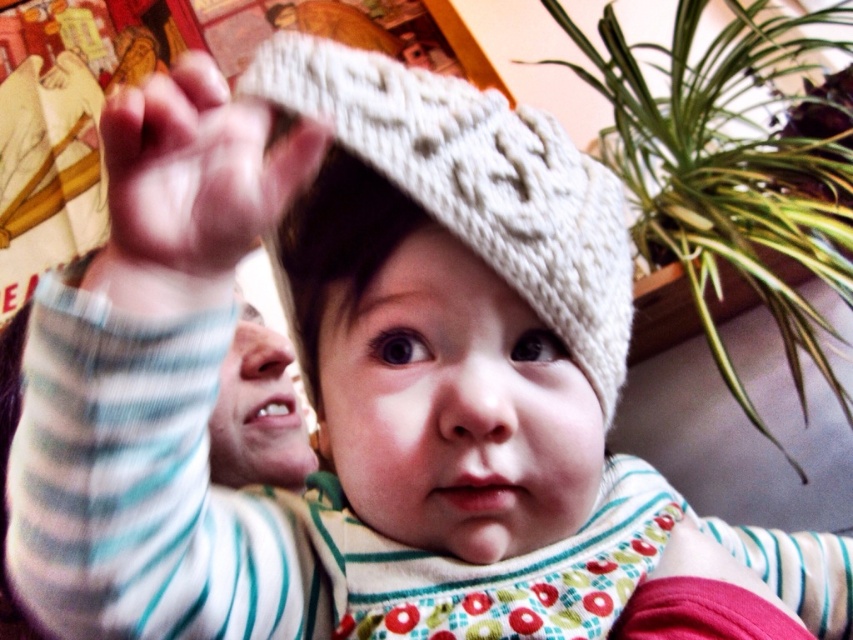
Can you confirm if green leafy plant at upper right is thinner than white knitted hand at upper center?

No.

Is green leafy plant at upper right to the right of white knitted hand at upper center from the viewer's perspective?

Yes, green leafy plant at upper right is to the right of white knitted hand at upper center.

Locate an element on the screen. This screenshot has height=640, width=853. green leafy plant at upper right is located at coordinates (732, 172).

Locate an element on the screen. green leafy plant at upper right is located at coordinates (732, 172).

Does green leafy plant at upper right lie behind white knitted hat at center?

Yes, it is.

Consider the image. How much distance is there between green leafy plant at upper right and white knitted hat at center?

72.48 centimeters

Between point (750, 68) and point (538, 198), which one is positioned behind?

Positioned behind is point (750, 68).

The height and width of the screenshot is (640, 853). Find the location of `green leafy plant at upper right`. green leafy plant at upper right is located at coordinates (732, 172).

Can you confirm if white knitted hat at center is positioned to the left of white knitted hand at upper center?

In fact, white knitted hat at center is to the right of white knitted hand at upper center.

Which is above, white knitted hat at center or white knitted hand at upper center?

Positioned higher is white knitted hand at upper center.

You are a GUI agent. You are given a task and a screenshot of the screen. Output one action in this format:
    pyautogui.click(x=<x>, y=<y>)
    Task: Click on the white knitted hat at center
    The image size is (853, 640).
    Given the screenshot: What is the action you would take?
    pyautogui.click(x=479, y=182)